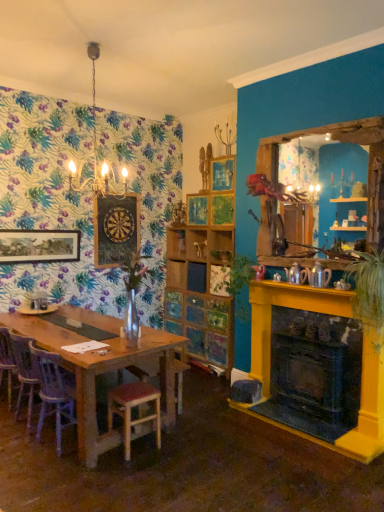
You are a GUI agent. You are given a task and a screenshot of the screen. Output one action in this format:
    pyautogui.click(x=<x>, y=<y>)
    Task: Click on the empty space that is ontop of wooden at left, acting as the first chair starting from the back (from a real-world perspective)
    This screenshot has width=384, height=512.
    Given the screenshot: What is the action you would take?
    pyautogui.click(x=41, y=330)